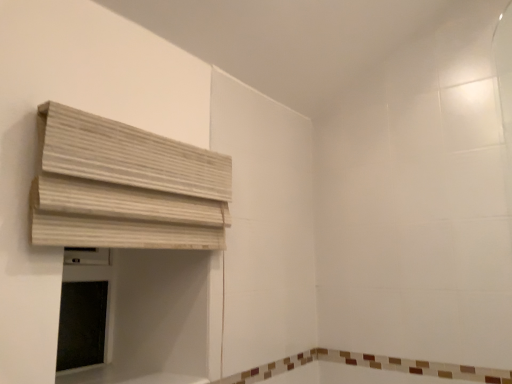
Question: Based on their sizes in the image, would you say brown tile bath at lower right is bigger or smaller than beige wood blinds at upper left?

Choices:
 (A) big
 (B) small

Answer: (B)

Question: In terms of width, does brown tile bath at lower right look wider or thinner when compared to beige wood blinds at upper left?

Choices:
 (A) wide
 (B) thin

Answer: (B)

Question: From a real-world perspective, is brown tile bath at lower right above or below beige wood blinds at upper left?

Choices:
 (A) below
 (B) above

Answer: (A)

Question: Is beige wood blinds at upper left wider or thinner than brown tile bath at lower right?

Choices:
 (A) thin
 (B) wide

Answer: (B)

Question: Is point (68, 236) positioned closer to the camera than point (340, 352)?

Choices:
 (A) closer
 (B) farther

Answer: (A)

Question: Considering the positions of beige wood blinds at upper left and brown tile bath at lower right in the image, is beige wood blinds at upper left bigger or smaller than brown tile bath at lower right?

Choices:
 (A) big
 (B) small

Answer: (A)

Question: Based on their positions, is beige wood blinds at upper left located to the left or right of brown tile bath at lower right?

Choices:
 (A) left
 (B) right

Answer: (A)